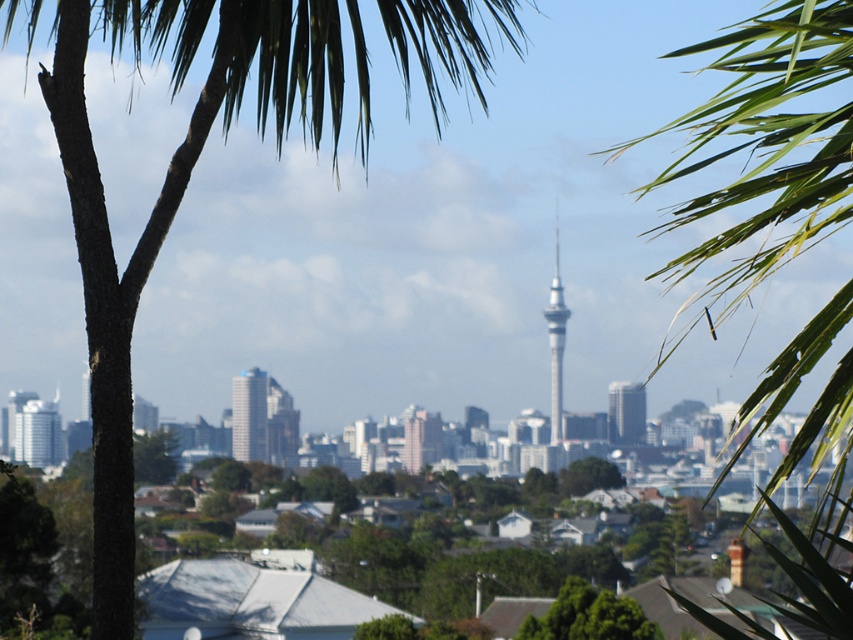
Is green leafy palm tree at left wider than green leafy palm tree at upper right?

Yes.

Is green leafy palm tree at left above green leafy palm tree at upper right?

Yes, green leafy palm tree at left is above green leafy palm tree at upper right.

Where is `green leafy palm tree at left`? green leafy palm tree at left is located at coordinates (175, 189).

Is smooth glass skyscraper at center above matte glass skyscraper at center?

No, smooth glass skyscraper at center is not above matte glass skyscraper at center.

Can you confirm if smooth glass skyscraper at center is positioned below matte glass skyscraper at center?

Yes.

Measure the distance between point [256,404] and camera.

Point [256,404] and camera are 660.44 meters apart.

This screenshot has height=640, width=853. I want to click on smooth glass skyscraper at center, so click(248, 416).

The width and height of the screenshot is (853, 640). I want to click on green leafy palm tree at upper right, so click(x=766, y=145).

What are the coordinates of `green leafy palm tree at upper right` in the screenshot? It's located at (766, 145).

Identify the location of green leafy palm tree at upper right. Image resolution: width=853 pixels, height=640 pixels. (766, 145).